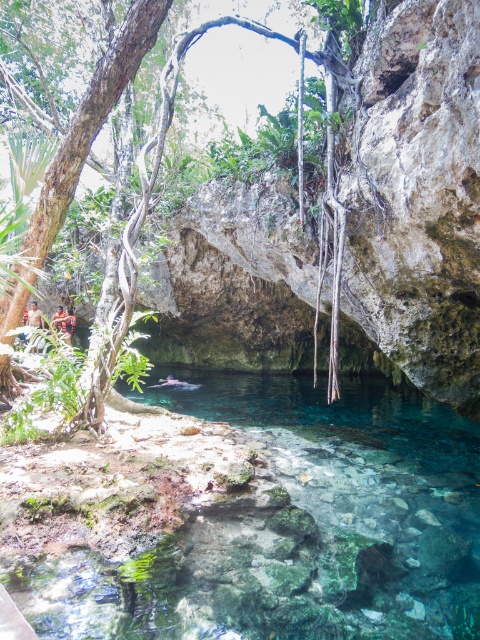
Question: Which of the following is the closest to the observer?

Choices:
 (A) clear glass water at center
 (B) green leafy tree at center

Answer: (A)

Question: From the image, what is the correct spatial relationship of clear glass water at center in relation to green leafy tree at center?

Choices:
 (A) right
 (B) left

Answer: (A)

Question: Considering the relative positions of clear glass water at center and green leafy tree at center in the image provided, where is clear glass water at center located with respect to green leafy tree at center?

Choices:
 (A) right
 (B) left

Answer: (A)

Question: Does clear glass water at center have a greater width compared to green leafy tree at center?

Choices:
 (A) no
 (B) yes

Answer: (B)

Question: Which point is closer to the camera?

Choices:
 (A) pyautogui.click(x=452, y=422)
 (B) pyautogui.click(x=123, y=257)

Answer: (B)

Question: Which point is closer to the camera taking this photo?

Choices:
 (A) (99, 392)
 (B) (121, 616)

Answer: (B)